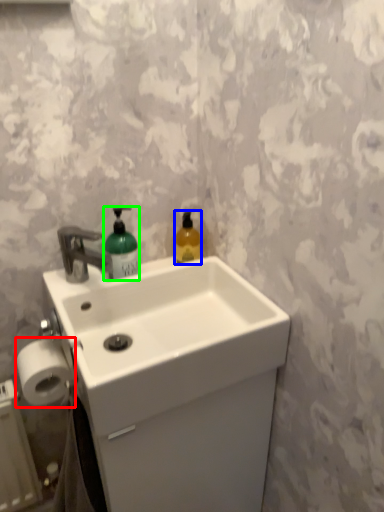
Question: Based on their relative distances, which object is nearer to toilet paper (highlighted by a red box)? Choose from bottle (highlighted by a blue box) and bottle (highlighted by a green box).

Choices:
 (A) bottle
 (B) bottle

Answer: (B)